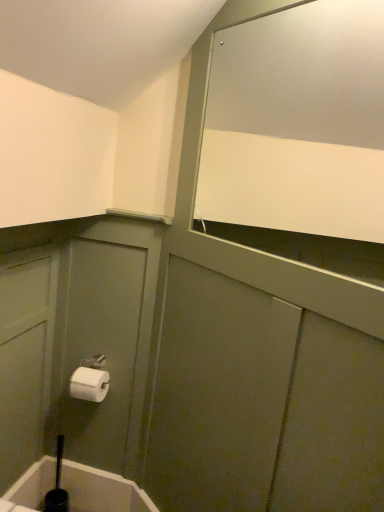
Image resolution: width=384 pixels, height=512 pixels. In order to click on white matte toilet paper at lower left in this screenshot , I will do `click(89, 384)`.

The width and height of the screenshot is (384, 512). I want to click on white matte toilet paper at lower left, so click(89, 384).

Would you consider black rubber toilet brush at lower left to be distant from white matte toilet paper at lower left?

No, black rubber toilet brush at lower left is not far from white matte toilet paper at lower left.

Does black rubber toilet brush at lower left have a lesser height compared to white matte toilet paper at lower left?

In fact, black rubber toilet brush at lower left may be taller than white matte toilet paper at lower left.

Can you tell me how much black rubber toilet brush at lower left and white matte toilet paper at lower left differ in facing direction?

The angle between the facing direction of black rubber toilet brush at lower left and the facing direction of white matte toilet paper at lower left is 0.185 degrees.

Is black rubber toilet brush at lower left looking in the opposite direction of white matte toilet paper at lower left?

That's not correct — black rubber toilet brush at lower left is not looking away from white matte toilet paper at lower left.

Is white matte toilet paper at lower left inside or outside of white glossy mirror at upper right?

white matte toilet paper at lower left is located beyond the bounds of white glossy mirror at upper right.

From the image's perspective, is white matte toilet paper at lower left beneath white glossy mirror at upper right?

Yes, from the image's perspective, white matte toilet paper at lower left is below white glossy mirror at upper right.

Could you tell me if white matte toilet paper at lower left is turned towards white glossy mirror at upper right?

No, white matte toilet paper at lower left is not turned towards white glossy mirror at upper right.

Considering the sizes of objects white matte toilet paper at lower left and white glossy mirror at upper right in the image provided, who is shorter, white matte toilet paper at lower left or white glossy mirror at upper right?

Standing shorter between the two is white matte toilet paper at lower left.

In the scene shown: Is white matte toilet paper at lower left located outside black rubber toilet brush at lower left?

Absolutely, white matte toilet paper at lower left is external to black rubber toilet brush at lower left.

Does white matte toilet paper at lower left appear on the right side of black rubber toilet brush at lower left?

Yes, white matte toilet paper at lower left is to the right of black rubber toilet brush at lower left.

Is white matte toilet paper at lower left oriented towards black rubber toilet brush at lower left?

No, white matte toilet paper at lower left is not facing towards black rubber toilet brush at lower left.

Which point is more forward, (86, 380) or (85, 485)?

The point (86, 380) is closer to the camera.

Is white glossy mirror at upper right further to camera compared to black rubber toilet brush at lower left?

That is False.

Considering the relative sizes of white glossy mirror at upper right and black rubber toilet brush at lower left in the image provided, is white glossy mirror at upper right smaller than black rubber toilet brush at lower left?

Actually, white glossy mirror at upper right might be larger than black rubber toilet brush at lower left.

Is white glossy mirror at upper right oriented away from black rubber toilet brush at lower left?

white glossy mirror at upper right does not have its back to black rubber toilet brush at lower left.

The image size is (384, 512). In order to click on bath that is behind the white glossy mirror at upper right in this screenshot , I will do `click(102, 490)`.

Based on the photo, considering the relative positions of white glossy mirror at upper right and white matte toilet paper at lower left in the image provided, is white glossy mirror at upper right to the left of white matte toilet paper at lower left from the viewer's perspective?

Incorrect, white glossy mirror at upper right is not on the left side of white matte toilet paper at lower left.

Considering the positions of points (336, 50) and (101, 396), is point (336, 50) closer to camera compared to point (101, 396)?

Yes, it is.

Measure the distance between white glossy mirror at upper right and white matte toilet paper at lower left.

white glossy mirror at upper right is 3.58 feet away from white matte toilet paper at lower left.

Does white glossy mirror at upper right turn towards white matte toilet paper at lower left?

No, white glossy mirror at upper right is not aimed at white matte toilet paper at lower left.

Is black rubber toilet brush at lower left looking in the opposite direction of white glossy mirror at upper right?

No, black rubber toilet brush at lower left is not facing away from white glossy mirror at upper right.

The image size is (384, 512). Find the location of `mirror above the black rubber toilet brush at lower left (from the image's perspective)`. mirror above the black rubber toilet brush at lower left (from the image's perspective) is located at coordinates (300, 134).

Considering the relative sizes of black rubber toilet brush at lower left and white glossy mirror at upper right in the image provided, is black rubber toilet brush at lower left wider than white glossy mirror at upper right?

No.

Locate an element on the screen. Image resolution: width=384 pixels, height=512 pixels. bath behind the white matte toilet paper at lower left is located at coordinates (102, 490).

There is a white matte toilet paper at lower left. Where is `mirror above it (from a real-world perspective)`? mirror above it (from a real-world perspective) is located at coordinates (300, 134).

From the picture: When comparing their distances from black rubber toilet brush at lower left, does white matte toilet paper at lower left or white glossy mirror at upper right seem closer?

The object closer to black rubber toilet brush at lower left is white matte toilet paper at lower left.

Considering their positions, is black rubber toilet brush at lower left positioned closer to white glossy mirror at upper right than white matte toilet paper at lower left?

Based on the image, white matte toilet paper at lower left appears to be nearer to white glossy mirror at upper right.

Looking at this image, based on their spatial positions, is white glossy mirror at upper right or black rubber toilet brush at lower left closer to white matte toilet paper at lower left?

black rubber toilet brush at lower left is closer to white matte toilet paper at lower left.

When comparing their distances from white matte toilet paper at lower left, does black rubber toilet brush at lower left or white glossy mirror at upper right seem closer?

The object closer to white matte toilet paper at lower left is black rubber toilet brush at lower left.

Which object lies nearer to the anchor point black rubber toilet brush at lower left, white glossy mirror at upper right or white matte toilet paper at lower left?

white matte toilet paper at lower left is closer to black rubber toilet brush at lower left.

From the image, which object appears to be nearer to white glossy mirror at upper right, white matte toilet paper at lower left or black rubber toilet brush at lower left?

white matte toilet paper at lower left lies closer to white glossy mirror at upper right than the other object.

Identify the location of toilet paper between white glossy mirror at upper right and black rubber toilet brush at lower left from top to bottom. This screenshot has width=384, height=512. (89, 384).